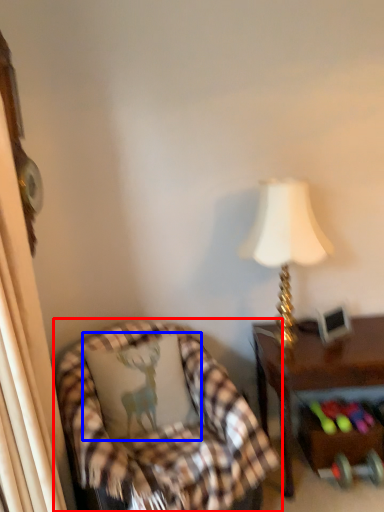
Question: Which of the following is the closest to the observer, chair (highlighted by a red box) or pillow (highlighted by a blue box)?

Choices:
 (A) chair
 (B) pillow

Answer: (A)